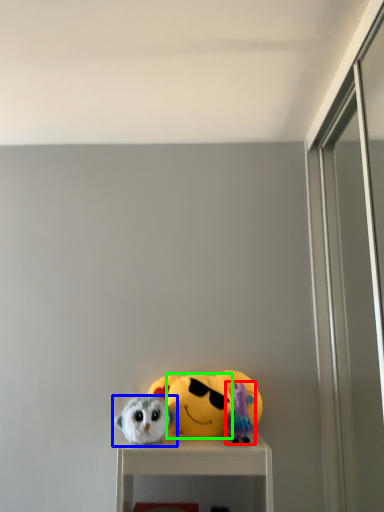
Question: Based on their relative distances, which object is nearer to toy (highlighted by a red box)? Choose from toy (highlighted by a blue box) and face (highlighted by a green box).

Choices:
 (A) toy
 (B) face

Answer: (B)